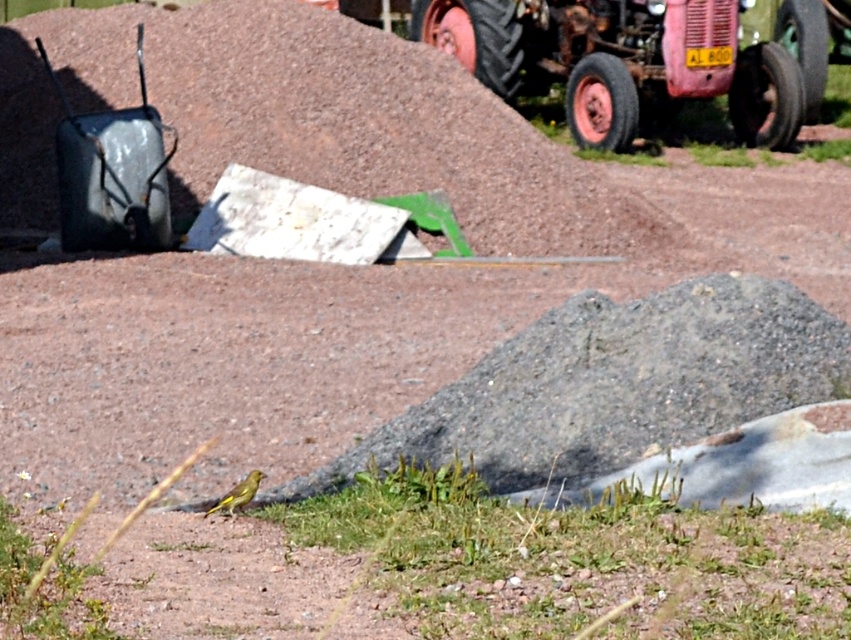
Is point (226, 81) farther from viewer compared to point (149, 209)?

Yes, point (226, 81) is farther from viewer.

Is brown gravel mound at upper center smaller than metallic gray wheelbarrow at left?

No, brown gravel mound at upper center is not smaller than metallic gray wheelbarrow at left.

Is point (483, 125) positioned behind point (151, 128)?

Yes, point (483, 125) is farther from viewer.

I want to click on brown gravel mound at upper center, so click(x=307, y=122).

Does brown gravel mound at upper center have a greater height compared to rusty metal tractor at upper center?

Indeed, brown gravel mound at upper center has a greater height compared to rusty metal tractor at upper center.

How much distance is there between brown gravel mound at upper center and rusty metal tractor at upper center?

brown gravel mound at upper center and rusty metal tractor at upper center are 4.66 meters apart.

Which is behind, point (32, 44) or point (683, 13)?

Point (683, 13)

Locate an element on the screen. brown gravel mound at upper center is located at coordinates (307, 122).

Measure the distance between rusty metal tractor at upper center and camera.

68.05 feet

Between rusty metal tractor at upper center and metallic gray wheelbarrow at left, which one has more height?

With more height is rusty metal tractor at upper center.

Which is in front, point (821, 52) or point (118, 202)?

Point (118, 202) is more forward.

Identify the location of rusty metal tractor at upper center. This screenshot has height=640, width=851. (638, 60).